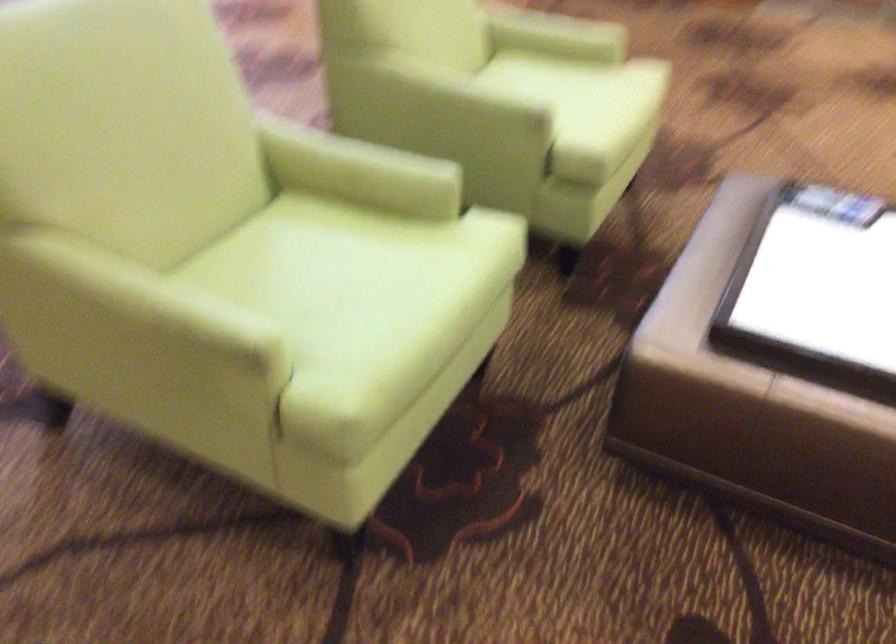
Based on the continuous images, in which direction is the camera rotating?

The rotation direction of the camera is right-down.